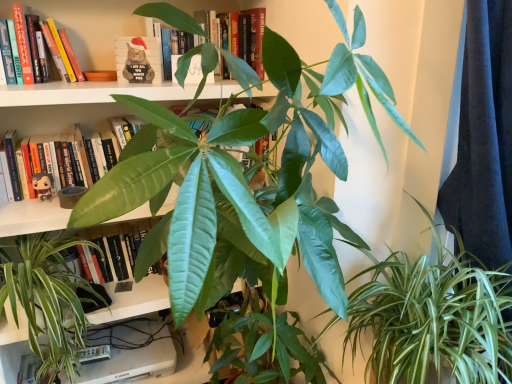
Question: Can you confirm if green matte leaf at upper center is taller than matte black figurine at left?

Choices:
 (A) yes
 (B) no

Answer: (A)

Question: From the image's perspective, would you say green matte leaf at upper center is shown under matte black figurine at left?

Choices:
 (A) no
 (B) yes

Answer: (A)

Question: Is green matte leaf at upper center behind matte black figurine at left?

Choices:
 (A) yes
 (B) no

Answer: (A)

Question: Considering the relative positions of green matte leaf at upper center and matte black figurine at left in the image provided, is green matte leaf at upper center to the left of matte black figurine at left from the viewer's perspective?

Choices:
 (A) yes
 (B) no

Answer: (B)

Question: Is green matte leaf at upper center smaller than matte black figurine at left?

Choices:
 (A) no
 (B) yes

Answer: (A)

Question: Is matte black figurine at left, arranged as the first book when ordered from the bottom, in front of or behind green glossy leafy plant at center, the second houseplant when ordered from right to left, in the image?

Choices:
 (A) behind
 (B) front

Answer: (A)

Question: From a real-world perspective, is matte black figurine at left, arranged as the first book when ordered from the bottom, physically located above or below green glossy leafy plant at center, the second houseplant in the left-to-right sequence?

Choices:
 (A) below
 (B) above

Answer: (B)

Question: Does point (71, 127) appear closer or farther from the camera than point (123, 200)?

Choices:
 (A) farther
 (B) closer

Answer: (A)

Question: Would you say matte black figurine at left, the third book when ordered from top to bottom, is inside or outside green glossy leafy plant at center, the second houseplant in the left-to-right sequence?

Choices:
 (A) outside
 (B) inside

Answer: (A)

Question: From the image's perspective, is hardcover book at upper left, arranged as the 2th book when viewed from the top, positioned above or below green glossy leafy plant at center, the second houseplant when ordered from right to left?

Choices:
 (A) above
 (B) below

Answer: (A)

Question: Is hardcover book at upper left, marked as the 2th book in a bottom-to-top arrangement, bigger or smaller than green glossy leafy plant at center, the second houseplant in the left-to-right sequence?

Choices:
 (A) big
 (B) small

Answer: (B)

Question: From a real-world perspective, is hardcover book at upper left, marked as the 2th book in a bottom-to-top arrangement, positioned above or below green glossy leafy plant at center, the second houseplant when ordered from right to left?

Choices:
 (A) below
 (B) above

Answer: (B)

Question: In the image, is hardcover book at upper left, marked as the 2th book in a bottom-to-top arrangement, positioned in front of or behind green glossy leafy plant at center, the second houseplant when ordered from right to left?

Choices:
 (A) front
 (B) behind

Answer: (B)

Question: Is point (181, 29) positioned closer to the camera than point (42, 180)?

Choices:
 (A) farther
 (B) closer

Answer: (B)

Question: From the image's perspective, relative to matte black figurine at left, is hardcover book at upper center, which appears as the third book when ordered from the bottom, above or below?

Choices:
 (A) above
 (B) below

Answer: (A)